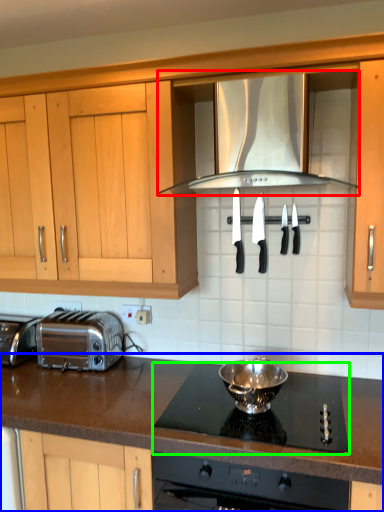
Question: Considering the real-world distances, which object is closest to exhaust hood (highlighted by a red box)? countertop (highlighted by a blue box) or gas stove (highlighted by a green box).

Choices:
 (A) countertop
 (B) gas stove

Answer: (B)